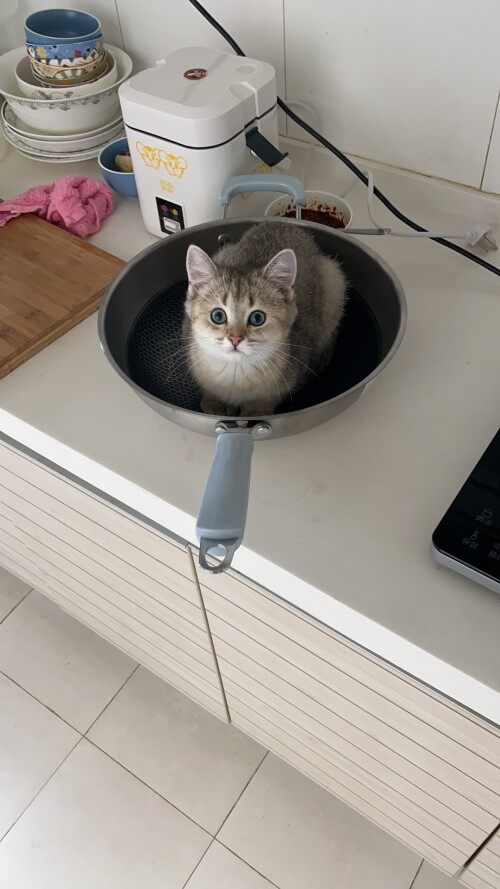
Identify the location of frying pan. (371, 351), (161, 335), (221, 475).